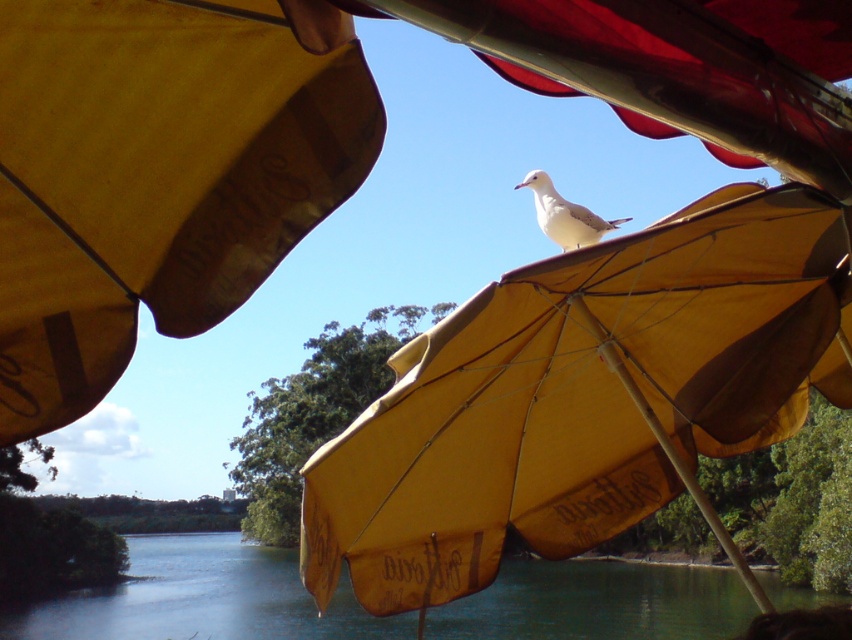
Question: Which object is positioned closest to the yellow matte umbrella at upper center?

Choices:
 (A) yellow fabric umbrella at center
 (B) white matte bird at center
 (C) transparent blue water at lower center

Answer: (A)

Question: Does transparent blue water at lower center appear on the right side of white matte bird at center?

Choices:
 (A) no
 (B) yes

Answer: (A)

Question: Which is farther from the yellow fabric umbrella at center?

Choices:
 (A) white matte bird at center
 (B) transparent blue water at lower center

Answer: (B)

Question: From the image, what is the correct spatial relationship of yellow matte umbrella at upper center in relation to white matte bird at center?

Choices:
 (A) left
 (B) right

Answer: (A)

Question: Which is farther from the white matte bird at center?

Choices:
 (A) yellow fabric umbrella at center
 (B) yellow matte umbrella at upper center
 (C) transparent blue water at lower center

Answer: (C)

Question: Can you confirm if transparent blue water at lower center is smaller than white matte bird at center?

Choices:
 (A) yes
 (B) no

Answer: (B)